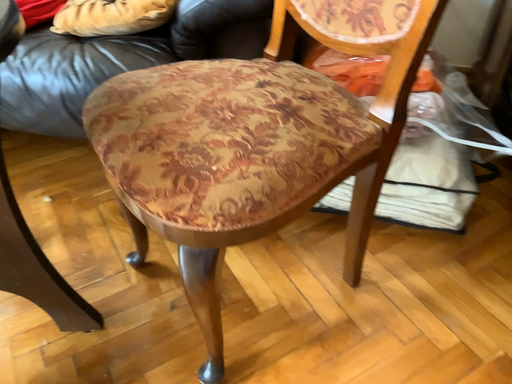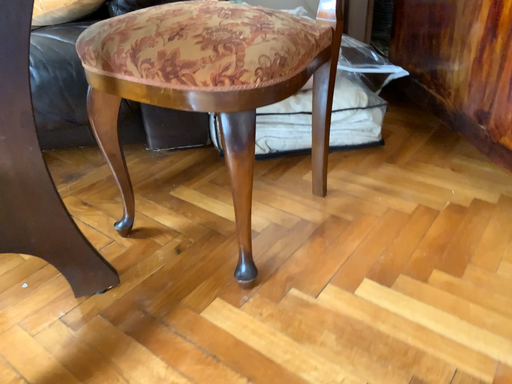
Question: Which way did the camera rotate in the video?

Choices:
 (A) rotated right
 (B) rotated left

Answer: (A)